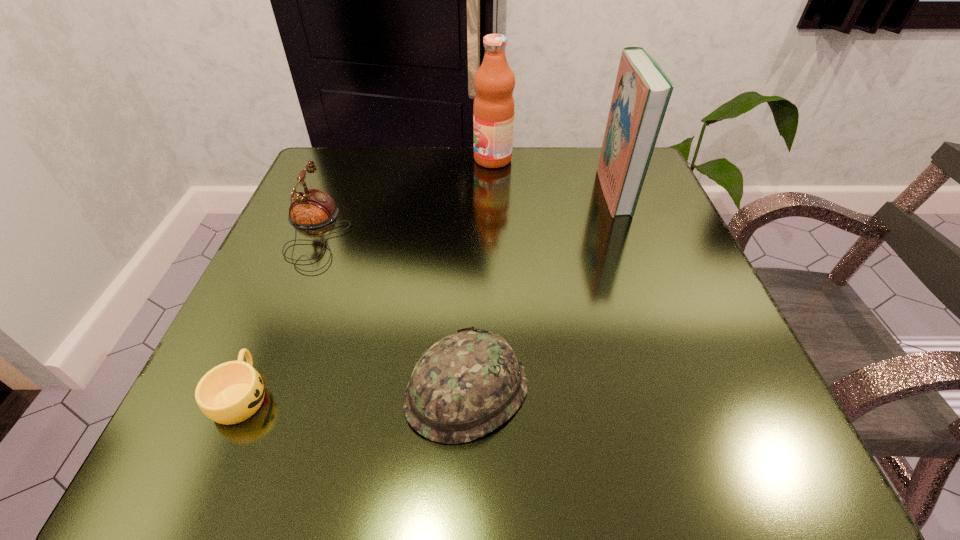
In the image, there is a desktop. Identify the location of free region at the near right corner. The height and width of the screenshot is (540, 960). (682, 441).

This screenshot has width=960, height=540. I want to click on vacant area that lies between the cup and the fruit juice, so click(368, 277).

Where is `vacant space in between the headwear and the telephone`? vacant space in between the headwear and the telephone is located at coordinates tap(391, 310).

Where is `free space between the telephone and the hardback book`? This screenshot has width=960, height=540. free space between the telephone and the hardback book is located at coordinates (465, 211).

This screenshot has height=540, width=960. Find the location of `blank region between the headwear and the shortest object`. blank region between the headwear and the shortest object is located at coordinates (354, 392).

You are a GUI agent. You are given a task and a screenshot of the screen. Output one action in this format:
    pyautogui.click(x=<x>, y=<y>)
    Task: Click on the free space between the telephone and the shortest object
    
    Given the screenshot: What is the action you would take?
    pyautogui.click(x=278, y=313)

Locate an element on the screen. vacant space in between the cup and the telephone is located at coordinates (278, 313).

Where is `vacant space that is in between the telephone and the rightmost object`? vacant space that is in between the telephone and the rightmost object is located at coordinates (465, 211).

The height and width of the screenshot is (540, 960). Identify the location of free point between the cup and the hardback book. (428, 293).

Identify the location of unoccupied area between the fruit juice and the telephone. This screenshot has height=540, width=960. (404, 195).